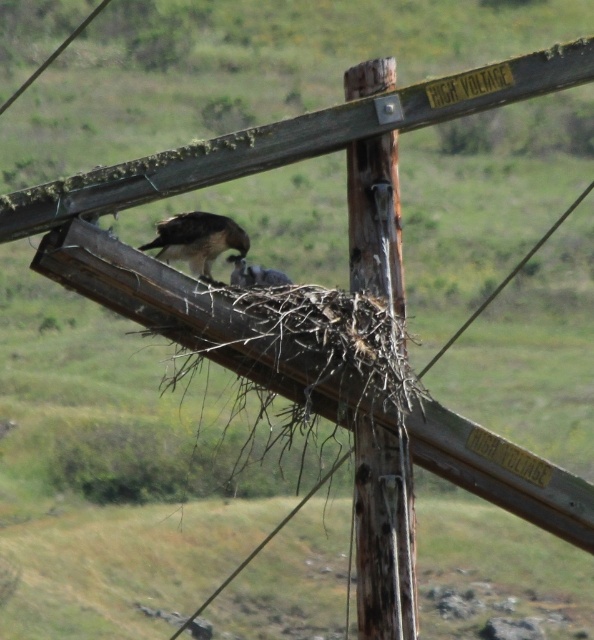
Which is below, brown feathered falcon at center or smooth wire at upper left?

Positioned lower is brown feathered falcon at center.

Can you confirm if brown feathered falcon at center is positioned to the right of smooth wire at upper left?

Indeed, brown feathered falcon at center is positioned on the right side of smooth wire at upper left.

Describe the element at coordinates (198, 241) in the screenshot. I see `brown feathered falcon at center` at that location.

Locate an element on the screen. Image resolution: width=594 pixels, height=640 pixels. brown feathered falcon at center is located at coordinates (198, 241).

Can you confirm if brown wooden telegraph pole at center is thinner than smooth wire at upper left?

Yes.

Is brown wooden telegraph pole at center in front of smooth wire at upper left?

Yes.

Is point (352, 179) positioned behind point (39, 67)?

No, (352, 179) is closer to viewer.

Identify the location of brown wooden telegraph pole at center. (383, 534).

This screenshot has width=594, height=640. What do you see at coordinates (383, 534) in the screenshot? I see `brown wooden telegraph pole at center` at bounding box center [383, 534].

Consider the image. Is the position of brown wooden telegraph pole at center less distant than that of brown feathered falcon at center?

Yes, it is in front of brown feathered falcon at center.

Between point (362, 227) and point (229, 228), which one is positioned in front?

Positioned in front is point (362, 227).

Find the location of a particular element. This screenshot has height=640, width=594. brown wooden telegraph pole at center is located at coordinates (383, 534).